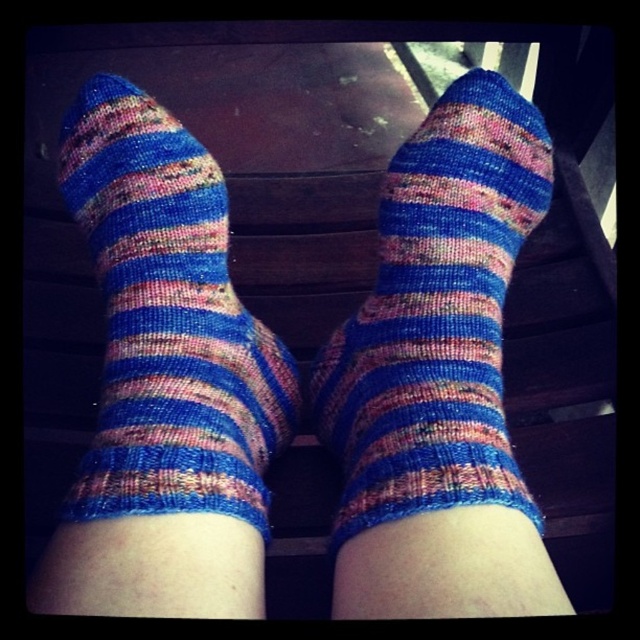
Question: Is blue striped sock at center wider than multicolored knitted sock at center?

Choices:
 (A) no
 (B) yes

Answer: (B)

Question: Among these points, which one is farthest from the camera?

Choices:
 (A) (113, 273)
 (B) (522, 492)

Answer: (A)

Question: Is blue striped sock at center wider than multicolored knitted sock at center?

Choices:
 (A) yes
 (B) no

Answer: (A)

Question: Is blue striped sock at center below multicolored knitted sock at center?

Choices:
 (A) yes
 (B) no

Answer: (A)